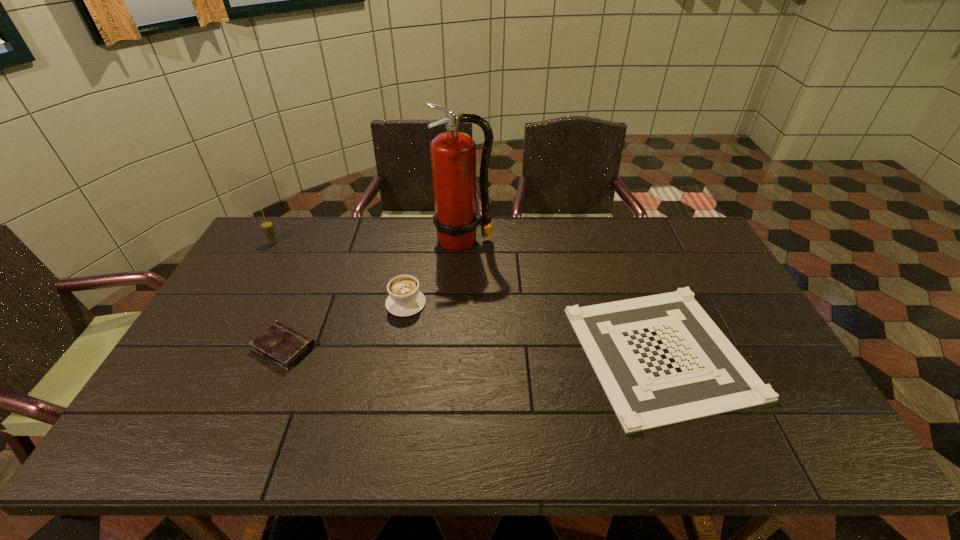
Locate an element on the screen. vacant space located at the nozzle of the tallest object is located at coordinates (459, 336).

What are the coordinates of `free space located on the front of the straw for drinking` in the screenshot? It's located at (245, 292).

Image resolution: width=960 pixels, height=540 pixels. I want to click on vacant region located 0.140m to the right of the third object from left to right's handle, so click(x=414, y=260).

Find the location of `free space located to the right of the third object from left to right's handle`. free space located to the right of the third object from left to right's handle is located at coordinates (418, 237).

Locate an element on the screen. free location located 0.380m to the right of the third object from left to right's handle is located at coordinates 420,219.

In order to click on free point located on the back of the second shortest object in this screenshot , I will do `click(310, 284)`.

Where is `blank area located on the back of the checkerboard`? blank area located on the back of the checkerboard is located at coordinates (633, 278).

Where is `fire extinguisher present at the far edge`? The height and width of the screenshot is (540, 960). fire extinguisher present at the far edge is located at coordinates (453, 154).

Locate an element on the screen. straw for drinking that is at the far edge is located at coordinates (267, 226).

Identify the location of object that is at the near edge. (660, 359).